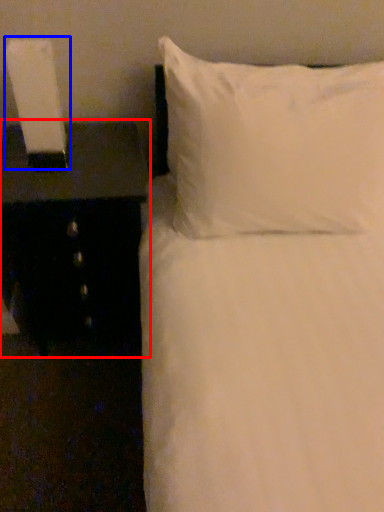
Question: Among these objects, which one is farthest to the camera, nightstand (highlighted by a red box) or bedside lamp (highlighted by a blue box)?

Choices:
 (A) nightstand
 (B) bedside lamp

Answer: (A)